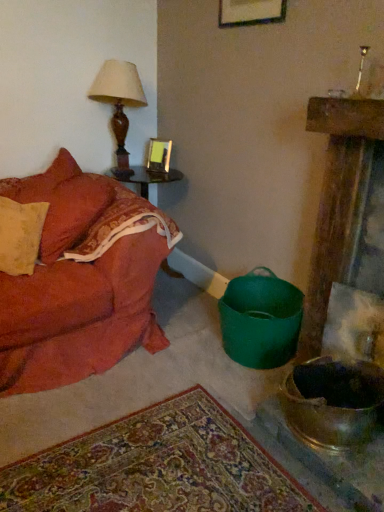
Question: Is velvet orange couch at left in front of or behind matte brown table lamp at upper left in the image?

Choices:
 (A) front
 (B) behind

Answer: (A)

Question: Considering the relative positions of velvet orange couch at left and matte brown table lamp at upper left in the image provided, is velvet orange couch at left to the left or to the right of matte brown table lamp at upper left?

Choices:
 (A) right
 (B) left

Answer: (B)

Question: Which of these objects is positioned closest to the matte glass picture frame at upper center?

Choices:
 (A) wooden round table at left
 (B) velvet orange couch at left
 (C) matte brown table lamp at upper left
 (D) shiny metallic mixing bowl at lower right

Answer: (A)

Question: Estimate the real-world distances between objects in this image. Which object is closer to the wooden round table at left?

Choices:
 (A) matte glass picture frame at upper center
 (B) matte brown table lamp at upper left
 (C) shiny metallic mixing bowl at lower right
 (D) velvet orange couch at left

Answer: (A)